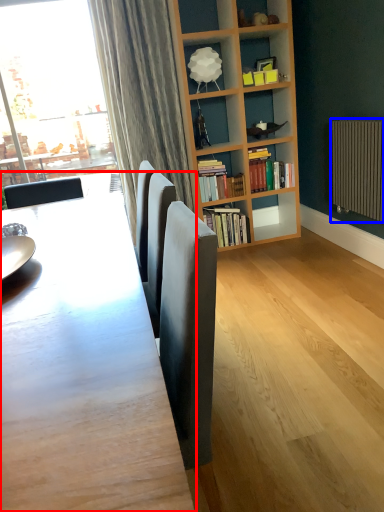
Question: Among these objects, which one is nearest to the camera, table (highlighted by a red box) or radiator (highlighted by a blue box)?

Choices:
 (A) table
 (B) radiator

Answer: (A)